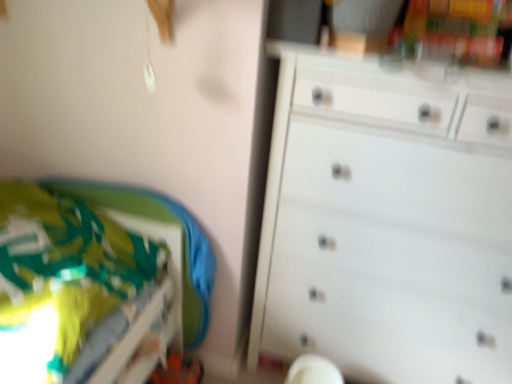
Where is `green fabric bed at lower left`? The height and width of the screenshot is (384, 512). green fabric bed at lower left is located at coordinates (87, 281).

What do you see at coordinates (313, 371) in the screenshot?
I see `white plastic swivel chair at lower center` at bounding box center [313, 371].

This screenshot has height=384, width=512. I want to click on white matte chest of drawers at right, so click(387, 222).

Consider the image. Is white matte chest of drawers at right not close to white plastic swivel chair at lower center?

They are positioned close to each other.

Which is correct: white matte chest of drawers at right is inside white plastic swivel chair at lower center, or outside of it?

white matte chest of drawers at right is located beyond the bounds of white plastic swivel chair at lower center.

Identify the location of the chest of drawers above the white plastic swivel chair at lower center (from a real-world perspective). (387, 222).

From a real-world perspective, which is physically above, white matte chest of drawers at right or white plastic swivel chair at lower center?

white matte chest of drawers at right, from a real-world perspective.

Is white plastic swivel chair at lower center facing away from white matte chest of drawers at right?

That's right, white plastic swivel chair at lower center is facing away from white matte chest of drawers at right.

Can you see white plastic swivel chair at lower center touching white matte chest of drawers at right?

white plastic swivel chair at lower center and white matte chest of drawers at right are clearly separated.

Looking at their sizes, would you say white plastic swivel chair at lower center is wider or thinner than white matte chest of drawers at right?

Considering their sizes, white plastic swivel chair at lower center looks slimmer than white matte chest of drawers at right.

Is white plastic swivel chair at lower center at the left side of white matte chest of drawers at right?

Indeed, white plastic swivel chair at lower center is positioned on the left side of white matte chest of drawers at right.

From a real-world perspective, is white plastic swivel chair at lower center physically above green fabric bed at lower left?

No.

Find the location of `bed in front of the white plastic swivel chair at lower center`. bed in front of the white plastic swivel chair at lower center is located at coordinates (87, 281).

Which object is thinner, white plastic swivel chair at lower center or green fabric bed at lower left?

Thinner between the two is white plastic swivel chair at lower center.

Is the depth of white plastic swivel chair at lower center less than that of green fabric bed at lower left?

No, the depth of white plastic swivel chair at lower center is greater than that of green fabric bed at lower left.

Can you confirm if green fabric bed at lower left is bigger than white plastic swivel chair at lower center?

Indeed, green fabric bed at lower left has a larger size compared to white plastic swivel chair at lower center.

Is green fabric bed at lower left in front of or behind white plastic swivel chair at lower center in the image?

green fabric bed at lower left is positioned closer to the viewer than white plastic swivel chair at lower center.

From a real-world perspective, is green fabric bed at lower left located beneath white plastic swivel chair at lower center?

No, from a real-world perspective, green fabric bed at lower left is not below white plastic swivel chair at lower center.

Who is shorter, white matte chest of drawers at right or green fabric bed at lower left?

With less height is green fabric bed at lower left.

Considering the relative positions of white matte chest of drawers at right and green fabric bed at lower left in the image provided, is white matte chest of drawers at right to the right of green fabric bed at lower left from the viewer's perspective?

Indeed, white matte chest of drawers at right is positioned on the right side of green fabric bed at lower left.

From a real-world perspective, who is located higher, white matte chest of drawers at right or green fabric bed at lower left?

In real-world perspective, white matte chest of drawers at right is above.

Would you consider green fabric bed at lower left to be distant from white matte chest of drawers at right?

No.

The image size is (512, 384). Find the location of `the chest of drawers that appears above the green fabric bed at lower left (from a real-world perspective)`. the chest of drawers that appears above the green fabric bed at lower left (from a real-world perspective) is located at coordinates (387, 222).

Is green fabric bed at lower left bigger or smaller than white matte chest of drawers at right?

Clearly, green fabric bed at lower left is smaller in size than white matte chest of drawers at right.

Which is behind, green fabric bed at lower left or white matte chest of drawers at right?

white matte chest of drawers at right is further from the camera.

Where is `swivel chair below the white matte chest of drawers at right (from the image's perspective)`? This screenshot has width=512, height=384. swivel chair below the white matte chest of drawers at right (from the image's perspective) is located at coordinates (313, 371).

At what (x,y) coordinates should I click in order to perform the action: click on the chest of drawers located above the white plastic swivel chair at lower center (from a real-world perspective). Please return your answer as a coordinate pair (x, y). This screenshot has height=384, width=512. Looking at the image, I should click on (387, 222).

Considering their positions, is green fabric bed at lower left positioned further to white plastic swivel chair at lower center than white matte chest of drawers at right?

The object further to white plastic swivel chair at lower center is green fabric bed at lower left.

Which object lies further to the anchor point white matte chest of drawers at right, white plastic swivel chair at lower center or green fabric bed at lower left?

green fabric bed at lower left is positioned further to the anchor white matte chest of drawers at right.

Which object lies nearer to the anchor point white matte chest of drawers at right, green fabric bed at lower left or white plastic swivel chair at lower center?

Among the two, white plastic swivel chair at lower center is located nearer to white matte chest of drawers at right.

Looking at the image, which one is located further to white plastic swivel chair at lower center, white matte chest of drawers at right or green fabric bed at lower left?

The object further to white plastic swivel chair at lower center is green fabric bed at lower left.

Based on their spatial positions, is white plastic swivel chair at lower center or white matte chest of drawers at right further from green fabric bed at lower left?

The object further to green fabric bed at lower left is white plastic swivel chair at lower center.

Considering their positions, is white matte chest of drawers at right positioned closer to green fabric bed at lower left than white plastic swivel chair at lower center?

Based on the image, white matte chest of drawers at right appears to be nearer to green fabric bed at lower left.

In order to click on swivel chair between green fabric bed at lower left and white matte chest of drawers at right in this screenshot , I will do `click(313, 371)`.